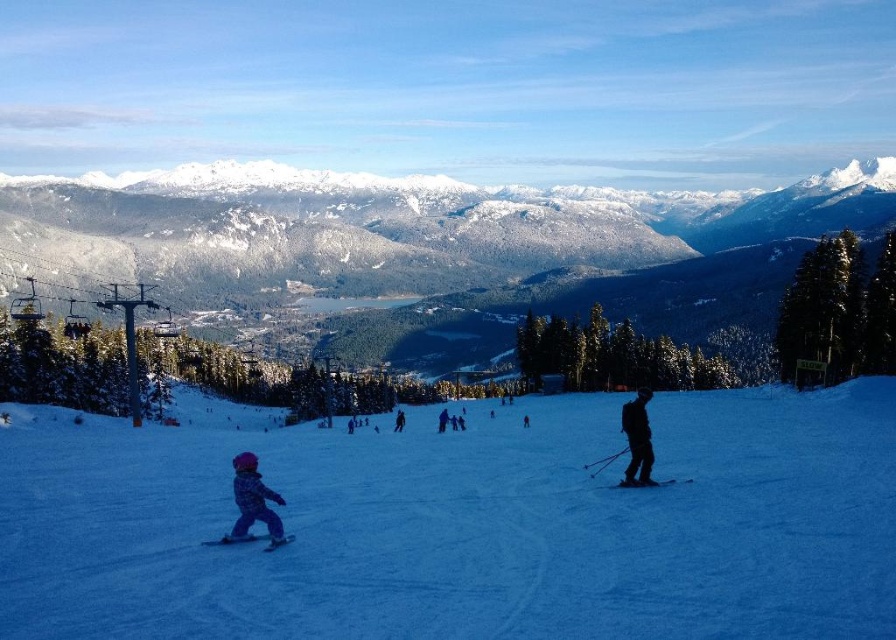
Looking at this image, you are a photographer standing at the bottom of the slope. You want to take a photo of the dark blue ski suit at center without the white snow ski slope at lower left blocking the view. Is this possible?

The white snow ski slope at lower left is in front of the dark blue ski suit at center, so it will block the view. Move to a position where the dark blue ski suit at center is in front of the white snow ski slope at lower left to avoid obstruction.

You are a photographer trying to capture a clear shot of both the black matte ski at center and the dark blue ski suit at center. Which object should you focus on first to ensure it appears larger in your photo?

The dark blue ski suit at center should be focused on first because it is larger than the black matte ski at center, ensuring it appears prominent in the photo.